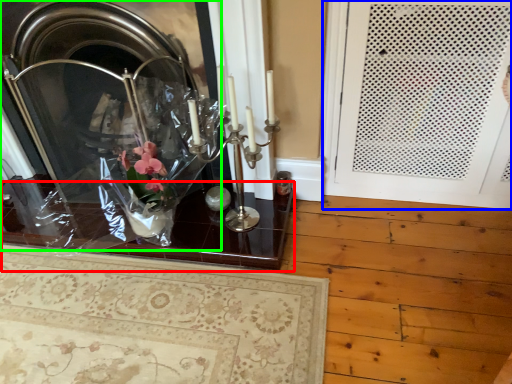
Question: Which object is positioned farthest from table (highlighted by a red box)? Select from door (highlighted by a blue box) and fireplace (highlighted by a green box).

Choices:
 (A) door
 (B) fireplace

Answer: (A)